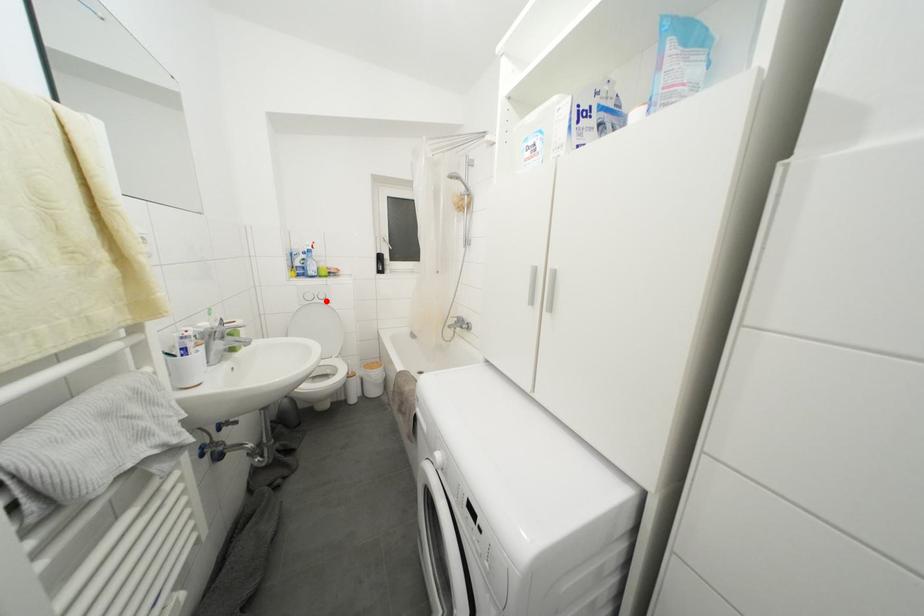
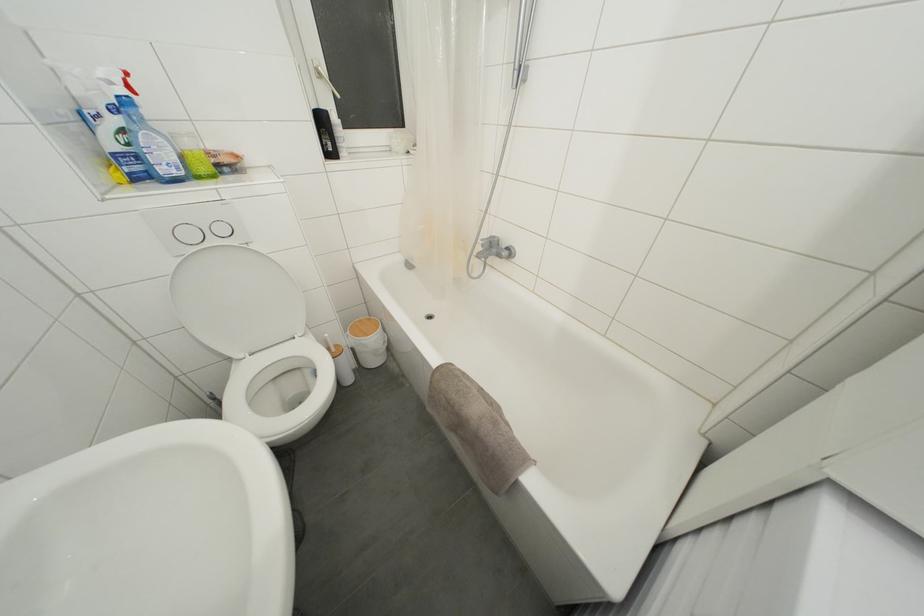
Question: I am providing you with two images of the same scene from different viewpoints. In image1, a red point is highlighted. Considering the same 3D point in image2, which of the following is correct?

Choices:
 (A) It is closer
 (B) It is farther

Answer: (A)